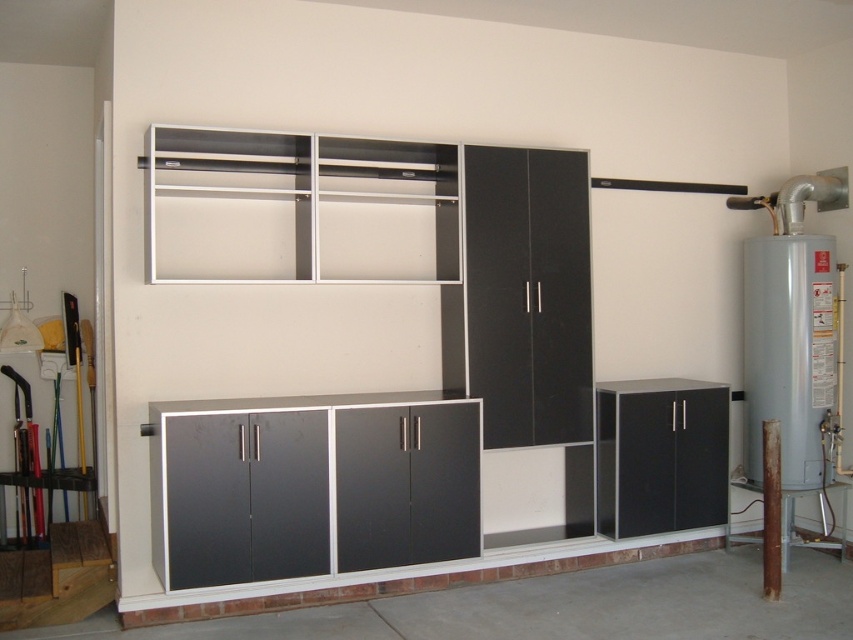
Question: Which of the following is the closest to the observer?

Choices:
 (A) matte black cabinet at lower right
 (B) white matte shelf at upper center

Answer: (B)

Question: Which point is farther from the camera taking this photo?

Choices:
 (A) (195, 218)
 (B) (718, 460)

Answer: (B)

Question: Is white matte shelf at upper center smaller than matte black cabinet at lower right?

Choices:
 (A) no
 (B) yes

Answer: (A)

Question: Is white matte shelf at upper center positioned behind matte black cabinet at lower right?

Choices:
 (A) no
 (B) yes

Answer: (A)

Question: Can you confirm if white matte shelf at upper center is wider than matte black cabinet at lower right?

Choices:
 (A) yes
 (B) no

Answer: (A)